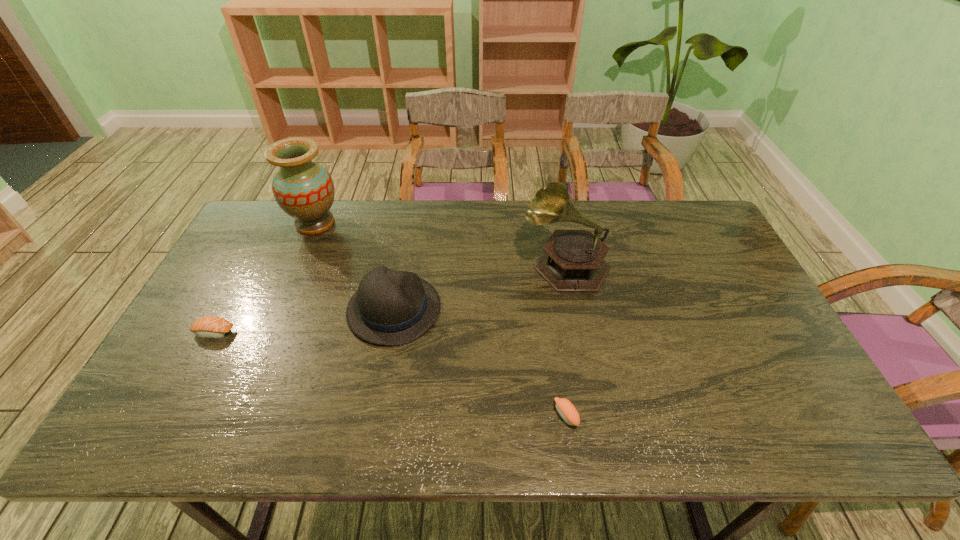
Find the location of a particular element. vase is located at coordinates (303, 189).

The image size is (960, 540). Find the location of `phonograph record`. phonograph record is located at coordinates (573, 260).

Find the location of a particular element. The width and height of the screenshot is (960, 540). the third object from left to right is located at coordinates (392, 308).

What are the coordinates of `the third tallest object` in the screenshot? It's located at (392, 308).

Identify the location of the left sushi. (215, 327).

Find the location of a particular element. the leftmost object is located at coordinates (215, 327).

Where is `the nearer sushi`? the nearer sushi is located at coordinates (565, 408).

This screenshot has width=960, height=540. What are the coordinates of `the right sushi` in the screenshot? It's located at (565, 408).

Locate an element on the screen. Image resolution: width=960 pixels, height=540 pixels. free space located 0.320m on the front of the second object from left to right is located at coordinates (276, 316).

Where is `vacant area located on the horn direction of the phonograph record`? The image size is (960, 540). vacant area located on the horn direction of the phonograph record is located at coordinates (471, 264).